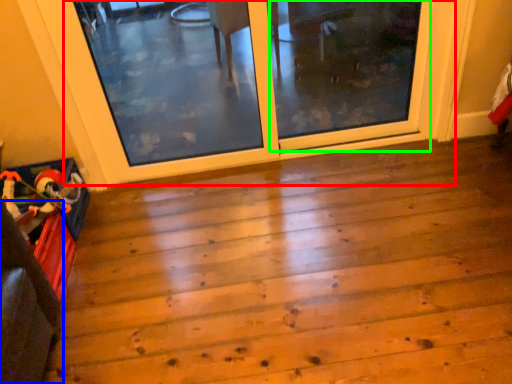
Question: Which object is the farthest from screen door (highlighted by a red box)? Choose among these: furniture (highlighted by a blue box) or screen door (highlighted by a green box).

Choices:
 (A) furniture
 (B) screen door

Answer: (A)